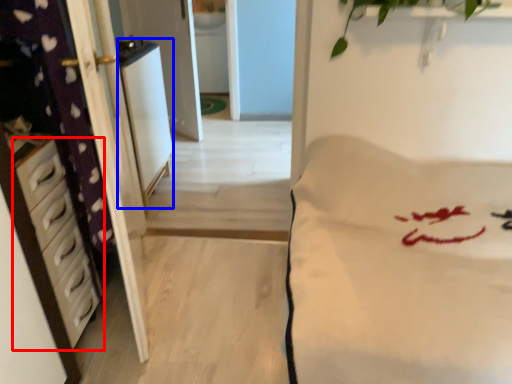
Question: Which point is further to the camera, chest of drawers (highlighted by a red box) or appliance (highlighted by a blue box)?

Choices:
 (A) chest of drawers
 (B) appliance

Answer: (B)